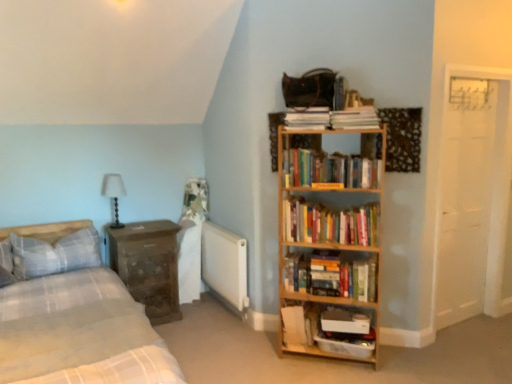
Question: Based on their positions, is white matte radiator at center located to the left or right of white paper at upper center, the second paperback book positioned from the bottom?

Choices:
 (A) left
 (B) right

Answer: (A)

Question: Would you say white matte radiator at center is inside or outside white paper at upper center, the 2th paperback book when ordered from top to bottom?

Choices:
 (A) outside
 (B) inside

Answer: (A)

Question: Which object is positioned farthest from the hardcover book at upper center, which is counted as the 1th paperback book, starting from the top?

Choices:
 (A) wooden nightstand at left
 (B) white paper at upper center, the second paperback book positioned from the bottom
 (C) white matte radiator at center
 (D) hardcover book at center, marked as the first paperback book in a bottom-to-top arrangement
 (E) plaid fabric pillow at left

Answer: (E)

Question: Which is farther from the white plastic container at lower center, the second shelf in the top-to-bottom sequence?

Choices:
 (A) hardcover books at center, which ranks as the first book in bottom-to-top order
 (B) hardcover books at center right, the 2th book from the top
 (C) white matte radiator at center
 (D) hardcover book at upper center, which is counted as the 1th paperback book, starting from the top
 (E) wooden bookshelf at upper right, marked as the 3th book in a bottom-to-top arrangement

Answer: (D)